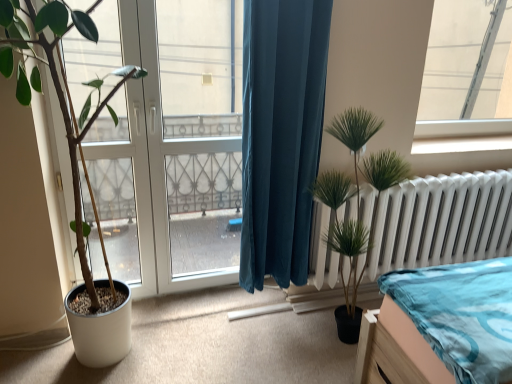
Question: Would you say transparent glass window at upper right is outside transparent glass door at left?

Choices:
 (A) no
 (B) yes

Answer: (B)

Question: Is transparent glass window at upper right placed right next to transparent glass door at left?

Choices:
 (A) no
 (B) yes

Answer: (A)

Question: From a real-world perspective, is transparent glass window at upper right physically below transparent glass door at left?

Choices:
 (A) no
 (B) yes

Answer: (A)

Question: From the image's perspective, is transparent glass window at upper right above transparent glass door at left?

Choices:
 (A) no
 (B) yes

Answer: (B)

Question: Is transparent glass window at upper right to the left of transparent glass door at left from the viewer's perspective?

Choices:
 (A) no
 (B) yes

Answer: (A)

Question: Is transparent glass window at upper right thinner than transparent glass door at left?

Choices:
 (A) yes
 (B) no

Answer: (A)

Question: Considering the relative sizes of green matte plant at left, the 1th houseplant from the left, and green artificial plant at right, the first houseplant positioned from the right, in the image provided, is green matte plant at left, the 1th houseplant from the left, taller than green artificial plant at right, the first houseplant positioned from the right,?

Choices:
 (A) yes
 (B) no

Answer: (A)

Question: Is the position of green matte plant at left, positioned as the 2th houseplant in right-to-left order, more distant than that of green artificial plant at right, which appears as the second houseplant when viewed from the left?

Choices:
 (A) no
 (B) yes

Answer: (A)

Question: From the image's perspective, is green matte plant at left, positioned as the 2th houseplant in right-to-left order, located beneath green artificial plant at right, which appears as the second houseplant when viewed from the left?

Choices:
 (A) no
 (B) yes

Answer: (A)

Question: Is green matte plant at left, positioned as the 2th houseplant in right-to-left order, turned away from green artificial plant at right, which appears as the second houseplant when viewed from the left?

Choices:
 (A) no
 (B) yes

Answer: (A)

Question: Is green artificial plant at right, which appears as the second houseplant when viewed from the left, a part of green matte plant at left, positioned as the 2th houseplant in right-to-left order?

Choices:
 (A) no
 (B) yes

Answer: (A)

Question: Considering the relative positions of green matte plant at left, the 1th houseplant from the left, and green artificial plant at right, the first houseplant positioned from the right, in the image provided, is green matte plant at left, the 1th houseplant from the left, to the right of green artificial plant at right, the first houseplant positioned from the right, from the viewer's perspective?

Choices:
 (A) no
 (B) yes

Answer: (A)

Question: Is transparent glass window at upper right at the right side of green artificial plant at right, the first houseplant positioned from the right?

Choices:
 (A) no
 (B) yes

Answer: (B)